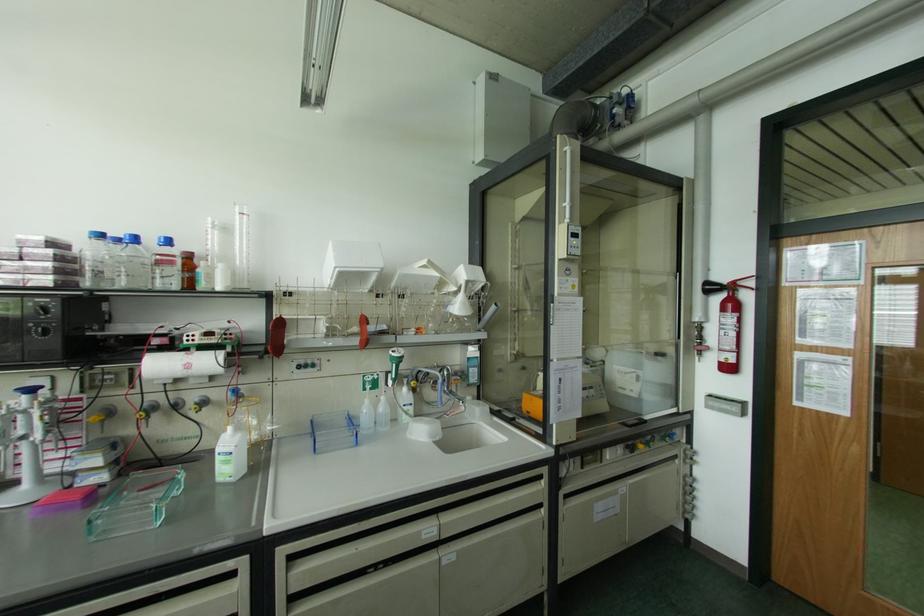
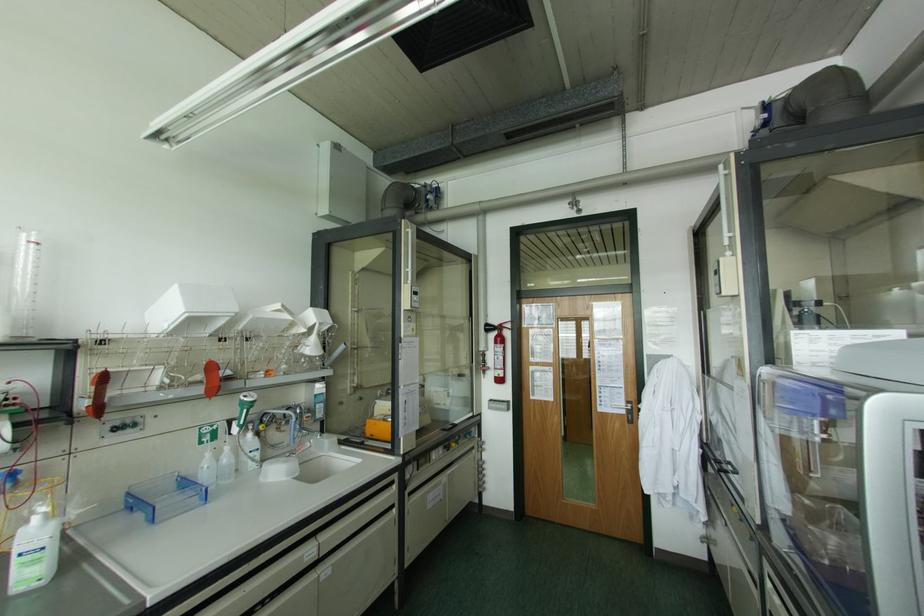
The point at (299, 367) is marked in the first image. Where is the corresponding point in the second image?

(115, 428)